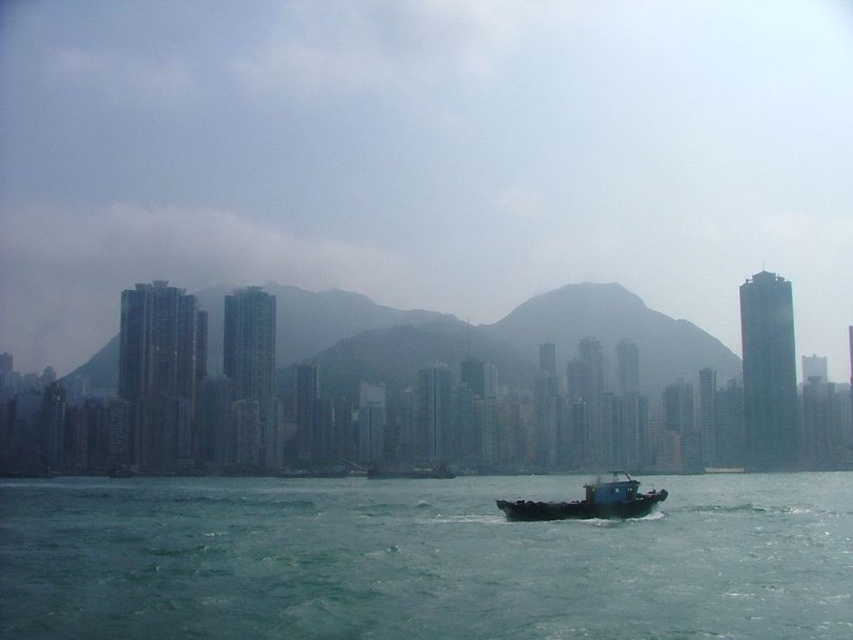
Question: Does greenish-blue water at center appear on the left side of blue matte boat at center?

Choices:
 (A) yes
 (B) no

Answer: (A)

Question: Which object appears closest to the camera in this image?

Choices:
 (A) blue matte boat at center
 (B) greenish-blue water at center

Answer: (B)

Question: Is greenish-blue water at center further to the viewer compared to blue matte boat at center?

Choices:
 (A) no
 (B) yes

Answer: (A)

Question: Does greenish-blue water at center lie in front of blue matte boat at center?

Choices:
 (A) no
 (B) yes

Answer: (B)